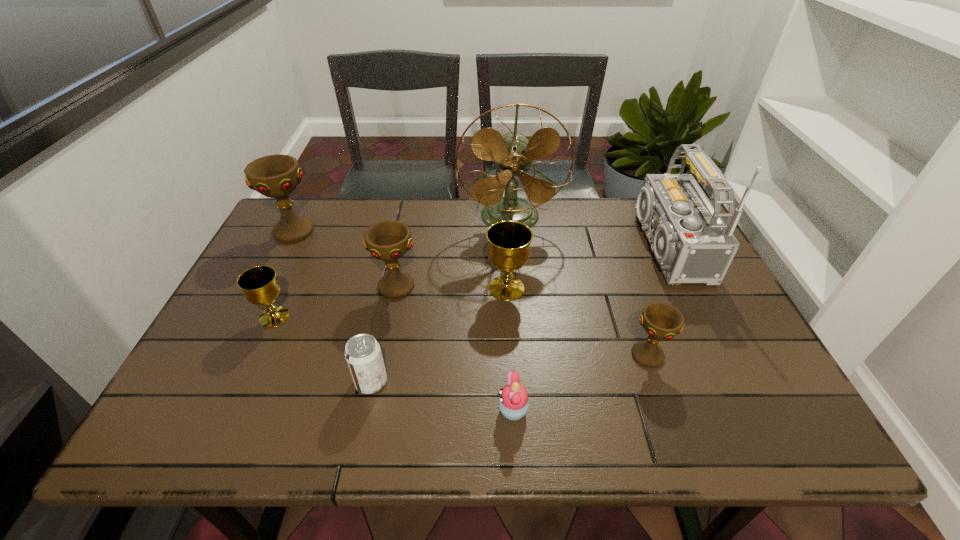
This screenshot has width=960, height=540. I want to click on fan, so click(513, 152).

Identify the location of gray radio receiver. This screenshot has height=540, width=960. (691, 242).

The height and width of the screenshot is (540, 960). Find the location of `the leftmost red chalice`. the leftmost red chalice is located at coordinates (276, 176).

I want to click on the farthest red chalice, so click(276, 176).

At what (x,y) coordinates should I click in order to perform the action: click on the second biggest red chalice. Please return your answer as a coordinate pair (x, y). The image size is (960, 540). Looking at the image, I should click on (388, 240).

This screenshot has height=540, width=960. Identify the location of the second red chalice from left to right. (388, 240).

Where is `the right gold chalice`? The image size is (960, 540). the right gold chalice is located at coordinates (508, 250).

At what (x,y) coordinates should I click in order to perform the action: click on the second chalice from right to left. Please return your answer as a coordinate pair (x, y). The image size is (960, 540). Looking at the image, I should click on (508, 250).

Locate an element on the screen. This screenshot has height=540, width=960. the left gold chalice is located at coordinates (260, 286).

At what (x,y) coordinates should I click in order to perform the action: click on the fourth nearest object. Please return your answer as a coordinate pair (x, y). This screenshot has width=960, height=540. Looking at the image, I should click on (260, 286).